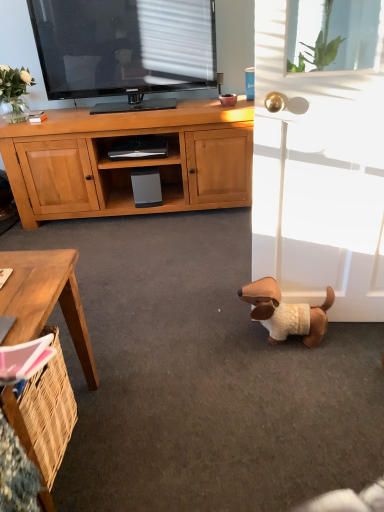
At what (x,y) coordinates should I click in order to perform the action: click on vacant area that lies in front of white matte screen door at lower right. Please return your answer as a coordinate pair (x, y). The height and width of the screenshot is (512, 384). Looking at the image, I should click on (332, 377).